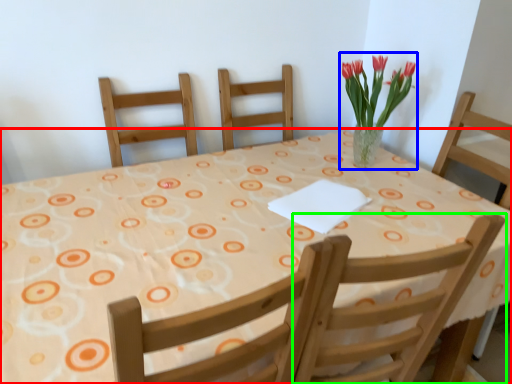
Question: Considering the real-world distances, which object is closest to table (highlighted by a red box)? floral arrangement (highlighted by a blue box) or chair (highlighted by a green box).

Choices:
 (A) floral arrangement
 (B) chair

Answer: (B)